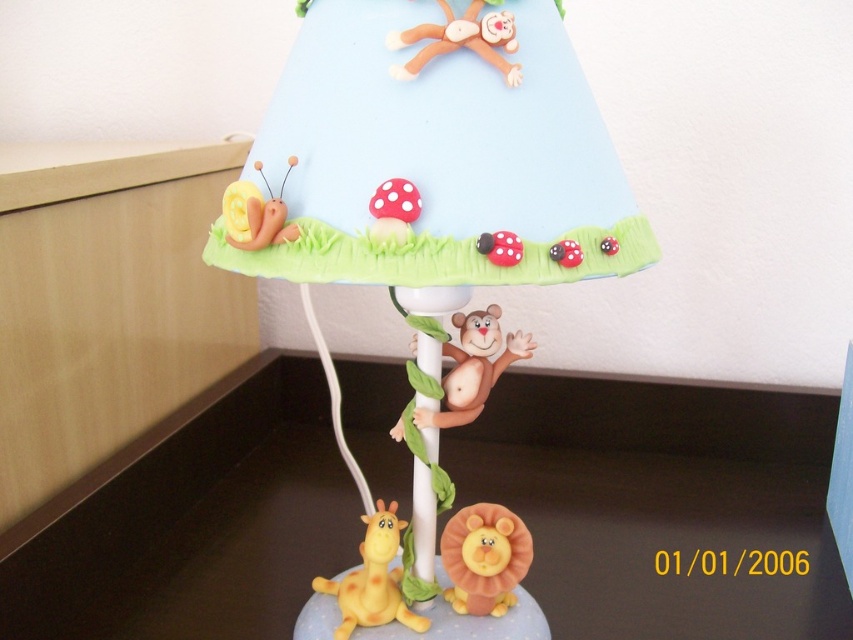
Between matte plastic monkey at center and yellow matte giraffe at lower left, which one is positioned higher?

matte plastic monkey at center is above.

Is point (421, 419) positioned after point (341, 600)?

No, it is not.

What do you see at coordinates (473, 368) in the screenshot? This screenshot has height=640, width=853. I see `matte plastic monkey at center` at bounding box center [473, 368].

Find the location of `matte plastic monkey at center`. matte plastic monkey at center is located at coordinates (473, 368).

Which is below, matte plastic monkey at upper center or yellow clay snail at upper left?

Positioned lower is yellow clay snail at upper left.

The width and height of the screenshot is (853, 640). I want to click on matte plastic monkey at upper center, so click(x=460, y=40).

Measure the distance between point (457,355) and camera.

Point (457,355) is 31.24 inches away from camera.

Who is more distant from viewer, (511, 340) or (508, 83)?

The point (511, 340) is behind.

Who is more distant from viewer, (480, 340) or (508, 76)?

The point (480, 340) is more distant.

Identify the location of matte plastic monkey at center. point(473,368).